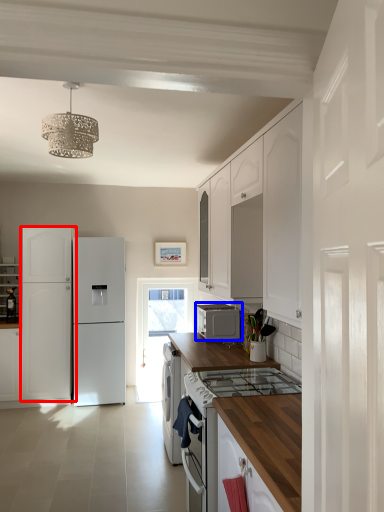
Question: Which object is closer to the camera taking this photo, cabinetry (highlighted by a red box) or home appliance (highlighted by a blue box)?

Choices:
 (A) cabinetry
 (B) home appliance

Answer: (B)